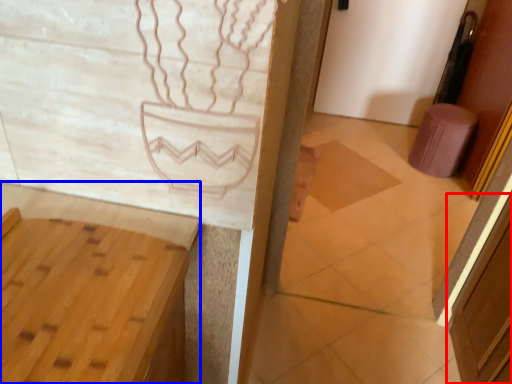
Question: Which point is closer to the camera, screen door (highlighted by a red box) or vanity (highlighted by a blue box)?

Choices:
 (A) screen door
 (B) vanity

Answer: (B)